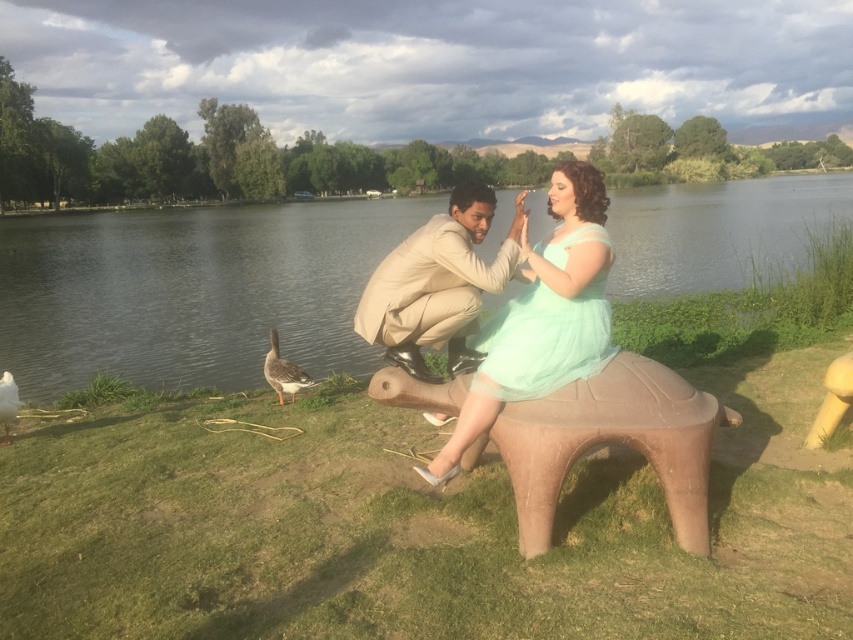
Question: Is smooth brown water at center wider than matte brown bench at center?

Choices:
 (A) yes
 (B) no

Answer: (A)

Question: Does smooth brown water at center appear under beige fabric suit at center?

Choices:
 (A) no
 (B) yes

Answer: (A)

Question: Is smooth brown water at center wider than brown feathered goose at lower left?

Choices:
 (A) no
 (B) yes

Answer: (B)

Question: Which object appears farthest from the camera in this image?

Choices:
 (A) brown feathered goose at lower left
 (B) smooth brown water at center
 (C) beige fabric suit at center
 (D) mint green tulle dress at center

Answer: (A)

Question: Which point appears farthest from the camera in this image?

Choices:
 (A) (428, 374)
 (B) (630, 420)
 (C) (306, 385)
 (D) (13, 410)

Answer: (C)

Question: Which of the following is the farthest from the observer?

Choices:
 (A) (434, 227)
 (B) (6, 349)
 (C) (297, 369)
 (D) (579, 212)

Answer: (B)